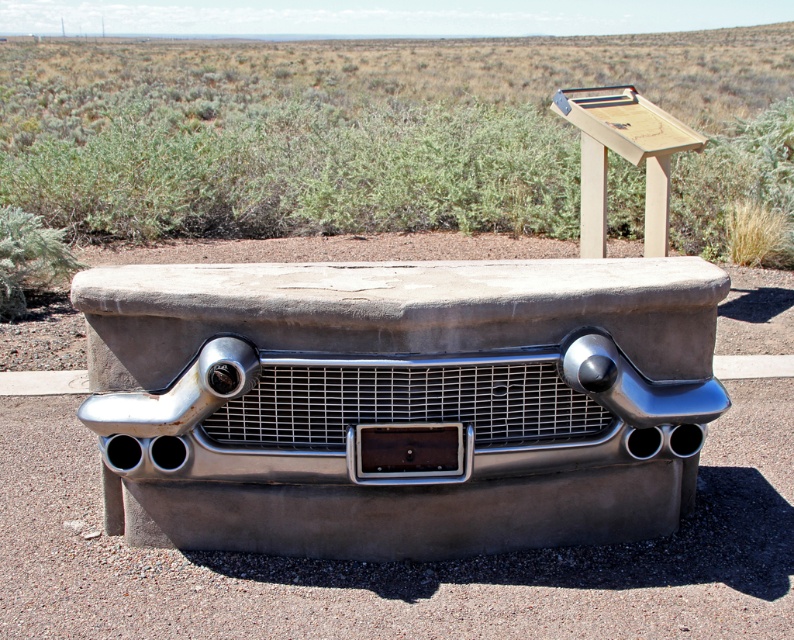
You are standing at the entrance of the desert installation and want to find the polished chrome car at center. According to the coordinates provided, where should you look relative to your position?

The polished chrome car at center is located at point 0.630 along the horizontal axis and 0.505 along the vertical axis, so you should look to the right and slightly forward from your current position at the entrance.

You are a maintenance worker responsible for cleaning the polished chrome car at center and the smooth concrete bumper at center. You have a 24 inch long cleaning tool. Can you reach from one to the other without moving the tool?

The distance between the polished chrome car at center and the smooth concrete bumper at center is 25.73 inches. Since the tool is only 24 inches long, you cannot reach from one to the other without moving the tool.